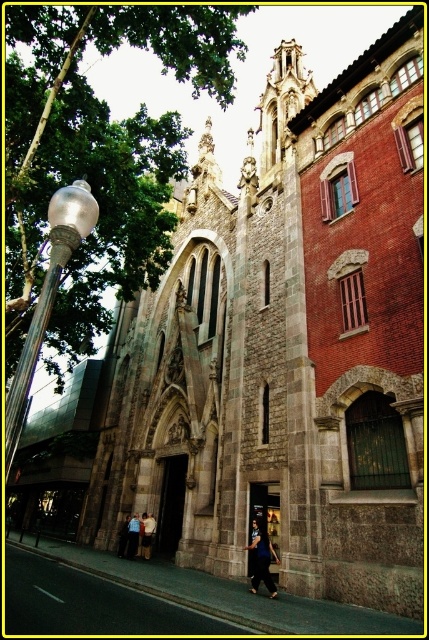
You are attending a wedding ceremony at the historic stone church and notice two guests wearing a dark blue fabric dress at center and a light blue shirt at center. Which clothing item is wider?

The dark blue fabric dress at center might be wider than the light blue shirt at center.

You are a fashion designer observing a person wearing both the light blue shirt at center and the light blue denim pants at lower center. Which clothing item appears smaller in size?

The light blue shirt at center has a smaller size compared to the light blue denim pants at lower center.